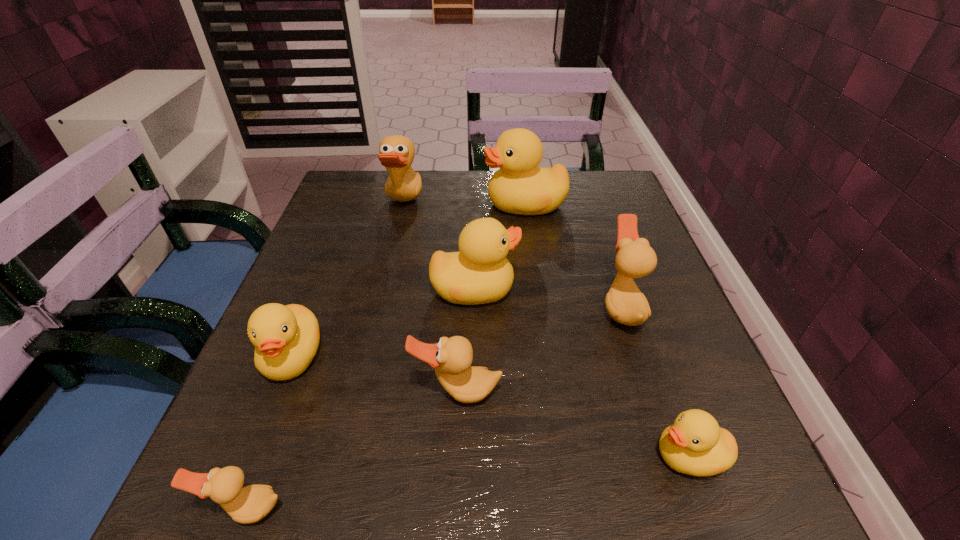
Locate which yellow duck is the third closest to the third smallest yellow duck. Please provide its 2D coordinates. Your answer should be formatted as a tuple, i.e. [(x, y)], where the tuple contains the x and y coordinates of a point satisfying the conditions above.

[(695, 445)]

Identify which tan duck is the nearest to the third object from left to right. Please provide its 2D coordinates. Your answer should be formatted as a tuple, i.e. [(x, y)], where the tuple contains the x and y coordinates of a point satisfying the conditions above.

[(625, 303)]

Locate an element on the screen. the second closest tan duck to the second farthest tan duck is located at coordinates (396, 153).

Find the location of a particular element. vacant space that satisfies the following two spatial constraints: 1. on the beak of the biggest tan duck; 2. on the beak of the nearest tan duck is located at coordinates (332, 509).

The image size is (960, 540). In order to click on free space that satisfies the following two spatial constraints: 1. on the beak of the second farthest tan duck; 2. on the beak of the second tan duck from right to left in this screenshot , I will do `click(649, 393)`.

Where is `vacant space that satisfies the following two spatial constraints: 1. on the beak of the third tan duck from right to left; 2. on the beak of the leftmost tan duck`? The height and width of the screenshot is (540, 960). vacant space that satisfies the following two spatial constraints: 1. on the beak of the third tan duck from right to left; 2. on the beak of the leftmost tan duck is located at coordinates (332, 509).

The image size is (960, 540). In order to click on vacant region that satisfies the following two spatial constraints: 1. at the beak of the third smallest yellow duck; 2. on the beak of the nearest tan duck in this screenshot , I will do `click(471, 509)`.

Where is `free region that satisfies the following two spatial constraints: 1. at the beak of the biggest yellow duck; 2. on the beak of the second tan duck from right to left`? free region that satisfies the following two spatial constraints: 1. at the beak of the biggest yellow duck; 2. on the beak of the second tan duck from right to left is located at coordinates (550, 393).